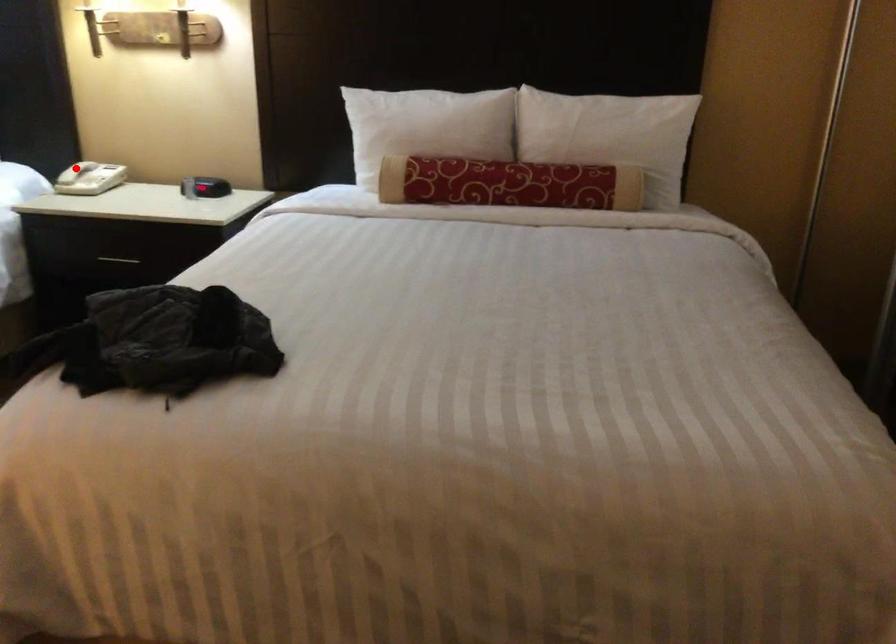
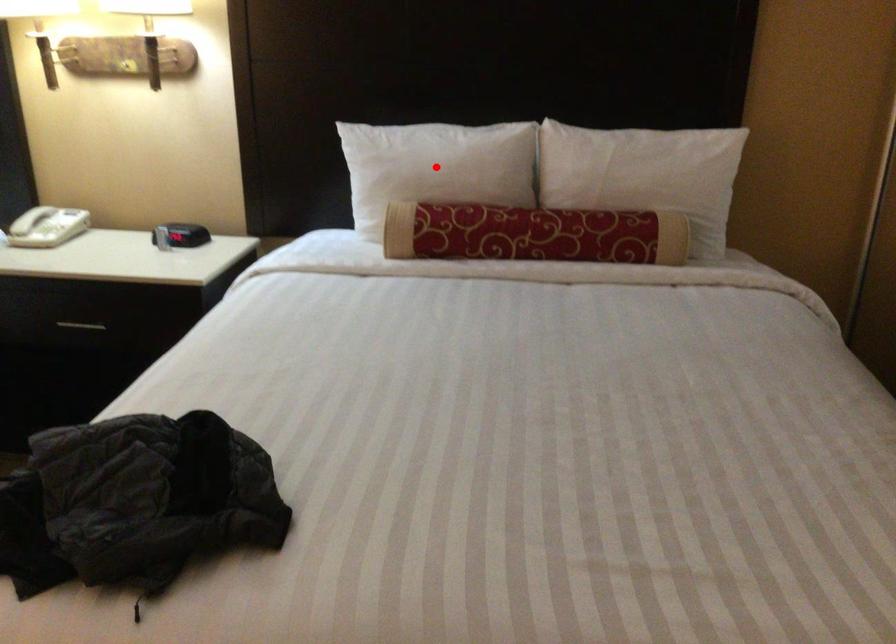
I am providing you with two images of the same scene from different viewpoints. A red point is marked on the first image and another point is marked on the second image. Are the points marked in image1 and image2 representing the same 3D position?

No